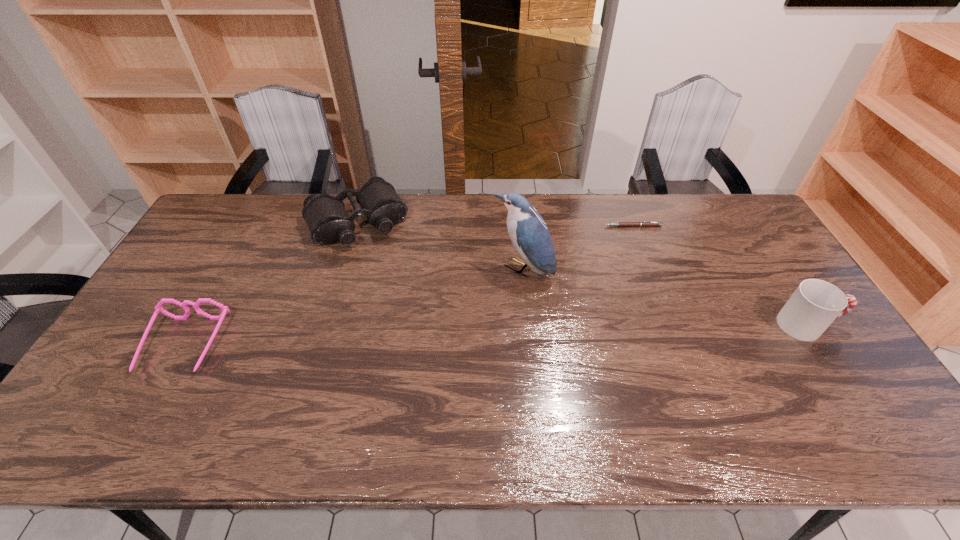
At what (x,y) coordinates should I click in order to perform the action: click on free space between the fourth object from left to right and the bird. Please return your answer as a coordinate pair (x, y). This screenshot has width=960, height=540. Looking at the image, I should click on (578, 248).

You are a GUI agent. You are given a task and a screenshot of the screen. Output one action in this format:
    pyautogui.click(x=<x>, y=<y>)
    Task: Click on the free space between the spectacles and the tallest object
    
    Given the screenshot: What is the action you would take?
    pyautogui.click(x=353, y=308)

This screenshot has height=540, width=960. I want to click on vacant area that lies between the second shortest object and the third farthest object, so click(x=353, y=308).

Where is `free space between the shortest object and the rightmost object`? The image size is (960, 540). free space between the shortest object and the rightmost object is located at coordinates (720, 275).

Where is `unoccupied area between the third nearest object and the fourth object from right to left`? This screenshot has width=960, height=540. unoccupied area between the third nearest object and the fourth object from right to left is located at coordinates (440, 246).

Find the location of `free spot between the rightmost object and the fourth object from right to left`. free spot between the rightmost object and the fourth object from right to left is located at coordinates (583, 273).

Where is `free spot between the fourth tallest object and the second object from left to right`? The image size is (960, 540). free spot between the fourth tallest object and the second object from left to right is located at coordinates (271, 284).

Locate an element on the screen. The image size is (960, 540). unoccupied position between the cup and the bird is located at coordinates (664, 298).

You are a GUI agent. You are given a task and a screenshot of the screen. Output one action in this format:
    pyautogui.click(x=<x>, y=<y>)
    Task: Click on the empty space that is in between the fourth tallest object and the third object from right to left
    
    Given the screenshot: What is the action you would take?
    pyautogui.click(x=353, y=308)

At what (x,y) coordinates should I click in order to perform the action: click on empty space that is in between the spectacles and the shortest object. Please return your answer as a coordinate pair (x, y). Image resolution: width=960 pixels, height=540 pixels. Looking at the image, I should click on (408, 286).